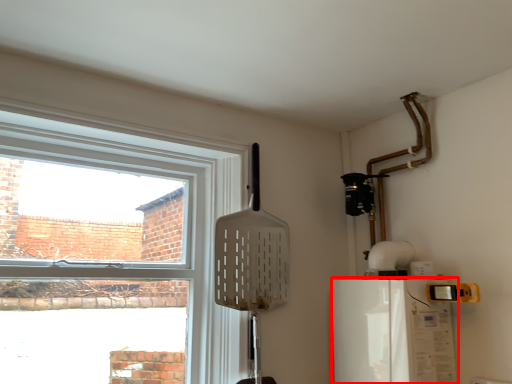
Question: Observing the image, what is the correct spatial positioning of appliance (annotated by the red box) in reference to window?

Choices:
 (A) left
 (B) right

Answer: (B)